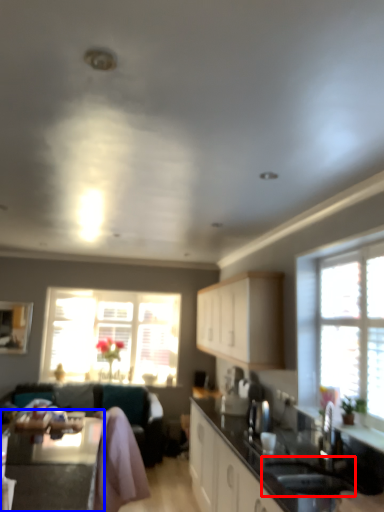
Question: Among these objects, which one is nearest to the camera, sink (highlighted by a red box) or table (highlighted by a blue box)?

Choices:
 (A) sink
 (B) table

Answer: (B)